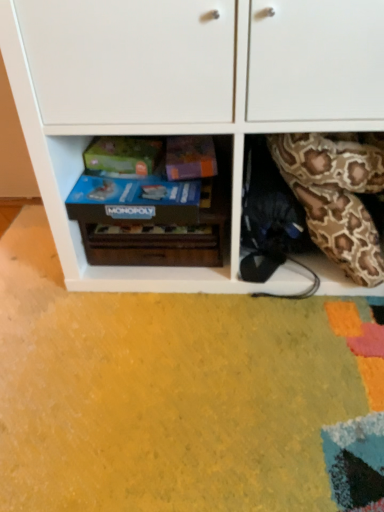
You are a GUI agent. You are given a task and a screenshot of the screen. Output one action in this format:
    pyautogui.click(x=<x>, y=<y>)
    Task: Click on the free location in front of wooden monopoly game at center
    The image size is (384, 512).
    Given the screenshot: What is the action you would take?
    pyautogui.click(x=154, y=341)